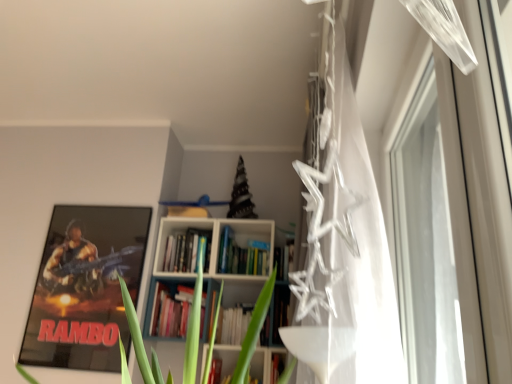
Question: Is transparent plastic stars at upper right positioned with its back to metallic rambo poster at left?

Choices:
 (A) yes
 (B) no

Answer: (B)

Question: Can you confirm if transparent plastic stars at upper right is thinner than metallic rambo poster at left?

Choices:
 (A) yes
 (B) no

Answer: (B)

Question: From a real-world perspective, is transparent plastic stars at upper right on metallic rambo poster at left?

Choices:
 (A) no
 (B) yes

Answer: (B)

Question: From the image's perspective, is transparent plastic stars at upper right below metallic rambo poster at left?

Choices:
 (A) yes
 (B) no

Answer: (B)

Question: Does transparent plastic stars at upper right have a lesser height compared to metallic rambo poster at left?

Choices:
 (A) yes
 (B) no

Answer: (B)

Question: Is metallic rambo poster at left to the left or to the right of transparent plastic stars at upper right in the image?

Choices:
 (A) right
 (B) left

Answer: (B)

Question: From the image's perspective, is metallic rambo poster at left positioned above or below transparent plastic stars at upper right?

Choices:
 (A) above
 (B) below

Answer: (B)

Question: In the image, is metallic rambo poster at left positioned in front of or behind transparent plastic stars at upper right?

Choices:
 (A) front
 (B) behind

Answer: (B)

Question: From their relative heights in the image, would you say metallic rambo poster at left is taller or shorter than transparent plastic stars at upper right?

Choices:
 (A) short
 (B) tall

Answer: (A)

Question: Is transparent plastic stars at upper right in front of or behind hardcover books at center in the image?

Choices:
 (A) behind
 (B) front

Answer: (B)

Question: Considering the positions of transparent plastic stars at upper right and hardcover books at center in the image, is transparent plastic stars at upper right taller or shorter than hardcover books at center?

Choices:
 (A) short
 (B) tall

Answer: (B)

Question: Considering the positions of point (330, 372) and point (184, 253), is point (330, 372) closer or farther from the camera than point (184, 253)?

Choices:
 (A) farther
 (B) closer

Answer: (B)

Question: In the image, is transparent plastic stars at upper right on the left side or the right side of hardcover books at center?

Choices:
 (A) right
 (B) left

Answer: (A)

Question: In terms of width, does metallic rambo poster at left look wider or thinner when compared to transparent glass window at upper right?

Choices:
 (A) wide
 (B) thin

Answer: (A)

Question: Is metallic rambo poster at left in front of or behind transparent glass window at upper right in the image?

Choices:
 (A) behind
 (B) front

Answer: (A)